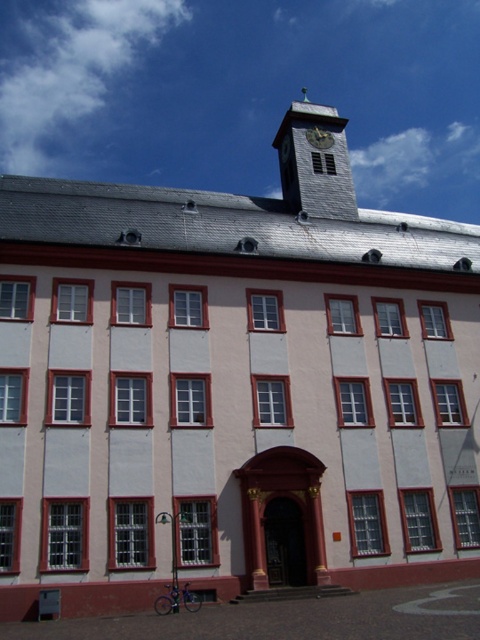
Consider the image. How much distance is there between gray stone clock tower at upper center and gold metallic clock at upper center?

The distance of gray stone clock tower at upper center from gold metallic clock at upper center is 27.33 meters.

Measure the distance between point (316, 182) and camera.

Point (316, 182) is 162.78 feet from camera.

Is point (288, 129) positioned after point (325, 132)?

Yes, it is.

Locate an element on the screen. The height and width of the screenshot is (640, 480). gray stone clock tower at upper center is located at coordinates (314, 161).